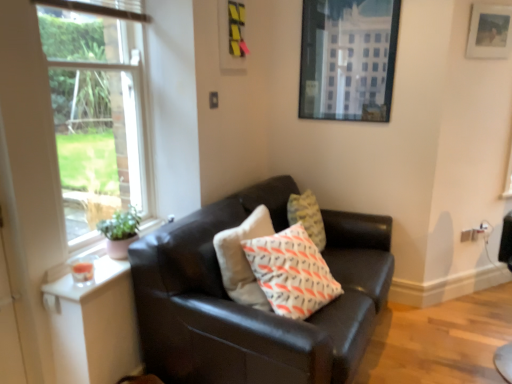
Question: From a real-world perspective, is white cotton pillow at center physically located above or below clear glass window at upper left?

Choices:
 (A) above
 (B) below

Answer: (B)

Question: Is white cotton pillow at center wider or thinner than clear glass window at upper left?

Choices:
 (A) wide
 (B) thin

Answer: (A)

Question: Which object is positioned closest to the white cotton pillow at center?

Choices:
 (A) metallic glass picture frame at upper right, the 2th picture frame viewed from the right
 (B) matte black couch at center
 (C) wooden picture frame at upper right, marked as the second picture frame in a left-to-right arrangement
 (D) clear glass window at upper left

Answer: (B)

Question: Considering the real-world distances, which object is closest to the white cotton pillow at center?

Choices:
 (A) wooden picture frame at upper right, marked as the second picture frame in a left-to-right arrangement
 (B) metallic glass picture frame at upper right, marked as the 1th picture frame in a left-to-right arrangement
 (C) matte black couch at center
 (D) clear glass window at upper left

Answer: (C)